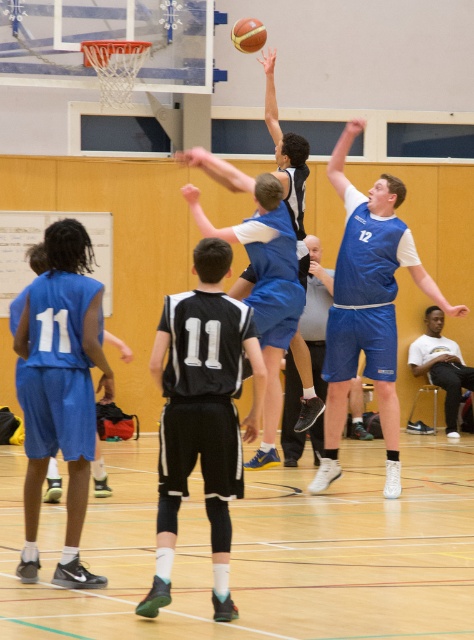
Who is positioned more to the right, matte blue shorts at left or orange rubber basketball at upper center?

orange rubber basketball at upper center

Does matte blue shorts at left appear under orange rubber basketball at upper center?

Yes, matte blue shorts at left is below orange rubber basketball at upper center.

Who is more forward, [71,326] or [255,29]?

Positioned in front is point [71,326].

In order to click on matte blue shorts at left in this screenshot , I will do `click(61, 390)`.

Does black jersey at center come behind orange rubber basketball at upper center?

No, it is not.

Between black jersey at center and orange rubber basketball at upper center, which one is positioned higher?

orange rubber basketball at upper center

Is point (228, 433) more distant than point (256, 35)?

No, it is not.

Image resolution: width=474 pixels, height=640 pixels. In order to click on black jersey at center in this screenshot , I will do [x=201, y=413].

You are a GUI agent. You are given a task and a screenshot of the screen. Output one action in this format:
    pyautogui.click(x=<x>, y=<y>)
    Task: Click on the wooden floor at center
    The width and height of the screenshot is (474, 640).
    Given the screenshot: What is the action you would take?
    pyautogui.click(x=263, y=552)

Between wooden floor at center and black jersey at center, which one appears on the left side from the viewer's perspective?

black jersey at center is more to the left.

Is point (10, 516) closer to viewer compared to point (228, 324)?

That is False.

You are a GUI agent. You are given a task and a screenshot of the screen. Output one action in this format:
    pyautogui.click(x=<x>, y=<y>)
    Task: Click on the wooden floor at center
    The height and width of the screenshot is (640, 474).
    Given the screenshot: What is the action you would take?
    pyautogui.click(x=263, y=552)